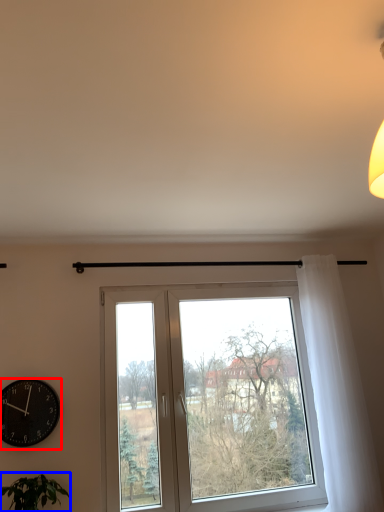
Question: Which point is further to the camera, wall clock (highlighted by a red box) or houseplant (highlighted by a blue box)?

Choices:
 (A) wall clock
 (B) houseplant

Answer: (A)